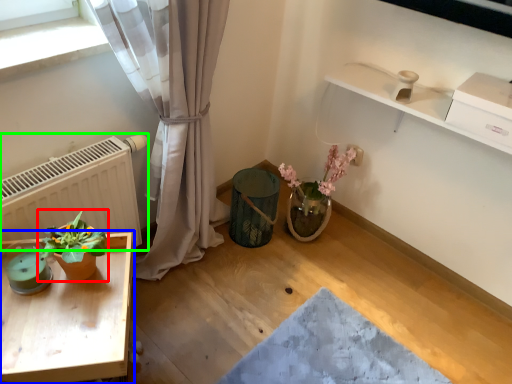
Question: Which object is positioned closest to houseplant (highlighted by a red box)? Select from table (highlighted by a blue box) and radiator (highlighted by a green box).

Choices:
 (A) table
 (B) radiator

Answer: (A)